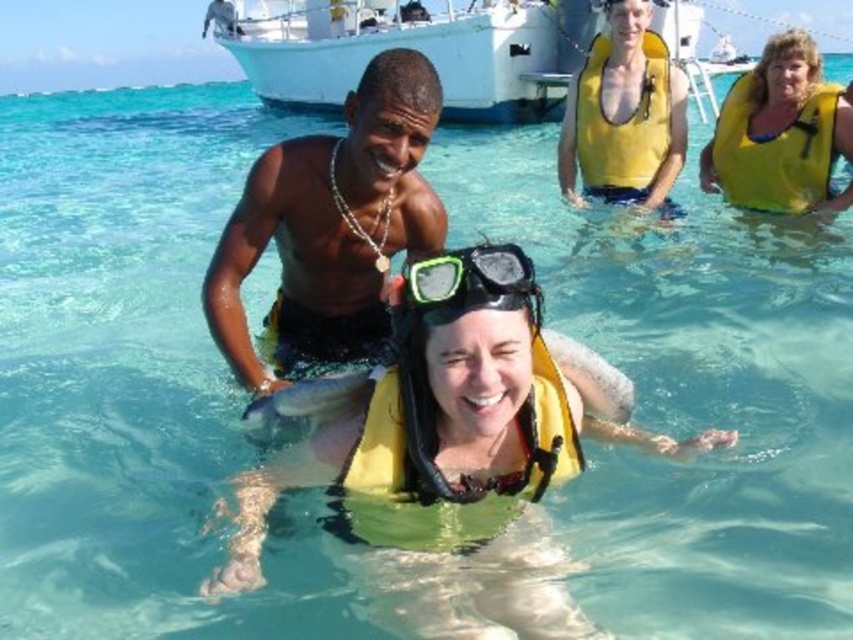
Can you confirm if yellow life vest at upper center is bigger than yellow life vest at upper right?

Incorrect, yellow life vest at upper center is not larger than yellow life vest at upper right.

Looking at this image, can you confirm if yellow life vest at upper center is positioned to the right of yellow life vest at upper right?

Incorrect, yellow life vest at upper center is not on the right side of yellow life vest at upper right.

Which is behind, point (643, 157) or point (799, 168)?

The point (643, 157) is behind.

Where is `yellow life vest at upper center`? The image size is (853, 640). yellow life vest at upper center is located at coordinates (625, 116).

This screenshot has width=853, height=640. I want to click on yellow foam life jacket at center, so click(407, 492).

Is point (548, 362) farther from viewer compared to point (421, 305)?

Yes, point (548, 362) is farther from viewer.

This screenshot has width=853, height=640. Identify the location of yellow foam life jacket at center. (407, 492).

Who is shorter, yellow life vest at upper center or green matte snorkel mask at center?

green matte snorkel mask at center is shorter.

Is yellow life vest at upper center to the right of green matte snorkel mask at center from the viewer's perspective?

Yes, yellow life vest at upper center is to the right of green matte snorkel mask at center.

Who is more forward, (602, 177) or (408, 276)?

Point (408, 276) is more forward.

Where is `yellow life vest at upper center`? The image size is (853, 640). yellow life vest at upper center is located at coordinates (625, 116).